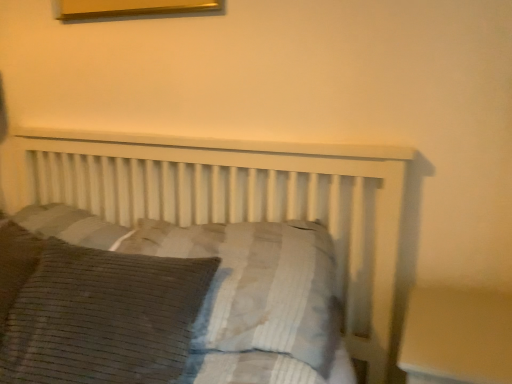
This screenshot has height=384, width=512. Describe the element at coordinates (257, 286) in the screenshot. I see `brown corduroy pillow at center, which is the 1th pillow in right-to-left order` at that location.

I want to click on brown corduroy pillow at center, which is the 1th pillow in right-to-left order, so [257, 286].

The width and height of the screenshot is (512, 384). What do you see at coordinates (103, 317) in the screenshot? I see `brown corduroy pillow at lower left, marked as the 2th pillow in a right-to-left arrangement` at bounding box center [103, 317].

The height and width of the screenshot is (384, 512). I want to click on brown corduroy pillow at lower left, marked as the 2th pillow in a right-to-left arrangement, so click(x=103, y=317).

I want to click on brown corduroy pillow at center, the second pillow positioned from the left, so click(257, 286).

Visually, is brown corduroy pillow at lower left, the 1th pillow in the left-to-right sequence, positioned to the left or to the right of brown corduroy pillow at center, the second pillow positioned from the left?

brown corduroy pillow at lower left, the 1th pillow in the left-to-right sequence, is positioned on brown corduroy pillow at center, the second pillow positioned from the left,'s left side.

Considering the positions of objects brown corduroy pillow at lower left, the 1th pillow in the left-to-right sequence, and brown corduroy pillow at center, which is the 1th pillow in right-to-left order, in the image provided, who is behind, brown corduroy pillow at lower left, the 1th pillow in the left-to-right sequence, or brown corduroy pillow at center, which is the 1th pillow in right-to-left order,?

Positioned behind is brown corduroy pillow at center, which is the 1th pillow in right-to-left order.

Which point is more forward, (159, 330) or (301, 329)?

Positioned in front is point (159, 330).

From the image's perspective, between brown corduroy pillow at lower left, the 1th pillow in the left-to-right sequence, and brown corduroy pillow at center, the second pillow positioned from the left, which one is located above?

brown corduroy pillow at center, the second pillow positioned from the left.

From a real-world perspective, who is located lower, brown corduroy pillow at lower left, the 1th pillow in the left-to-right sequence, or brown corduroy pillow at center, which is the 1th pillow in right-to-left order?

brown corduroy pillow at lower left, the 1th pillow in the left-to-right sequence, is physically lower.

Is brown corduroy pillow at lower left, marked as the 2th pillow in a right-to-left arrangement, thinner than brown corduroy pillow at center, the second pillow positioned from the left?

Yes, brown corduroy pillow at lower left, marked as the 2th pillow in a right-to-left arrangement, is thinner than brown corduroy pillow at center, the second pillow positioned from the left.

From the picture: Between brown corduroy pillow at lower left, the 1th pillow in the left-to-right sequence, and brown corduroy pillow at center, which is the 1th pillow in right-to-left order, which one has more height?

brown corduroy pillow at lower left, the 1th pillow in the left-to-right sequence, is taller.

Is brown corduroy pillow at lower left, the 1th pillow in the left-to-right sequence, bigger than brown corduroy pillow at center, which is the 1th pillow in right-to-left order?

No, brown corduroy pillow at lower left, the 1th pillow in the left-to-right sequence, is not bigger than brown corduroy pillow at center, which is the 1th pillow in right-to-left order.

Which is correct: brown corduroy pillow at lower left, marked as the 2th pillow in a right-to-left arrangement, is inside brown corduroy pillow at center, which is the 1th pillow in right-to-left order, or outside of it?

brown corduroy pillow at lower left, marked as the 2th pillow in a right-to-left arrangement, lies outside brown corduroy pillow at center, which is the 1th pillow in right-to-left order.

Consider the image. Is there a large distance between brown corduroy pillow at lower left, the 1th pillow in the left-to-right sequence, and brown corduroy pillow at center, the second pillow positioned from the left?

brown corduroy pillow at lower left, the 1th pillow in the left-to-right sequence, is near brown corduroy pillow at center, the second pillow positioned from the left, not far away.

Is brown corduroy pillow at lower left, the 1th pillow in the left-to-right sequence, aimed at brown corduroy pillow at center, the second pillow positioned from the left?

No, brown corduroy pillow at lower left, the 1th pillow in the left-to-right sequence, does not turn towards brown corduroy pillow at center, the second pillow positioned from the left.

How distant is brown corduroy pillow at lower left, the 1th pillow in the left-to-right sequence, from brown corduroy pillow at center, which is the 1th pillow in right-to-left order?

19.14 centimeters.

The width and height of the screenshot is (512, 384). Identify the location of pillow that appears in front of the brown corduroy pillow at center, the second pillow positioned from the left. 103,317.

In the scene shown: Between brown corduroy pillow at center, the second pillow positioned from the left, and brown corduroy pillow at lower left, marked as the 2th pillow in a right-to-left arrangement, which one appears on the left side from the viewer's perspective?

brown corduroy pillow at lower left, marked as the 2th pillow in a right-to-left arrangement, is more to the left.

Considering the positions of objects brown corduroy pillow at center, the second pillow positioned from the left, and brown corduroy pillow at lower left, marked as the 2th pillow in a right-to-left arrangement, in the image provided, who is in front, brown corduroy pillow at center, the second pillow positioned from the left, or brown corduroy pillow at lower left, marked as the 2th pillow in a right-to-left arrangement,?

brown corduroy pillow at lower left, marked as the 2th pillow in a right-to-left arrangement, is in front.

Is point (226, 303) closer to viewer compared to point (35, 366)?

No, it is not.

From the image's perspective, which object appears higher, brown corduroy pillow at center, the second pillow positioned from the left, or brown corduroy pillow at lower left, marked as the 2th pillow in a right-to-left arrangement?

brown corduroy pillow at center, the second pillow positioned from the left, from the image's perspective.

From a real-world perspective, which is physically above, brown corduroy pillow at center, which is the 1th pillow in right-to-left order, or brown corduroy pillow at lower left, marked as the 2th pillow in a right-to-left arrangement?

brown corduroy pillow at center, which is the 1th pillow in right-to-left order.

Considering the sizes of objects brown corduroy pillow at center, which is the 1th pillow in right-to-left order, and brown corduroy pillow at lower left, the 1th pillow in the left-to-right sequence, in the image provided, who is wider, brown corduroy pillow at center, which is the 1th pillow in right-to-left order, or brown corduroy pillow at lower left, the 1th pillow in the left-to-right sequence,?

brown corduroy pillow at center, which is the 1th pillow in right-to-left order, is wider.

Does brown corduroy pillow at center, the second pillow positioned from the left, have a lesser height compared to brown corduroy pillow at lower left, marked as the 2th pillow in a right-to-left arrangement?

Indeed, brown corduroy pillow at center, the second pillow positioned from the left, has a lesser height compared to brown corduroy pillow at lower left, marked as the 2th pillow in a right-to-left arrangement.

Considering the relative sizes of brown corduroy pillow at center, which is the 1th pillow in right-to-left order, and brown corduroy pillow at lower left, marked as the 2th pillow in a right-to-left arrangement, in the image provided, is brown corduroy pillow at center, which is the 1th pillow in right-to-left order, smaller than brown corduroy pillow at lower left, marked as the 2th pillow in a right-to-left arrangement,?

No, brown corduroy pillow at center, which is the 1th pillow in right-to-left order, is not smaller than brown corduroy pillow at lower left, marked as the 2th pillow in a right-to-left arrangement.

Is brown corduroy pillow at lower left, the 1th pillow in the left-to-right sequence, located within brown corduroy pillow at center, which is the 1th pillow in right-to-left order?

No, brown corduroy pillow at lower left, the 1th pillow in the left-to-right sequence, is not a part of brown corduroy pillow at center, which is the 1th pillow in right-to-left order.

Consider the image. Would you consider brown corduroy pillow at center, which is the 1th pillow in right-to-left order, to be distant from brown corduroy pillow at lower left, the 1th pillow in the left-to-right sequence?

No, brown corduroy pillow at center, which is the 1th pillow in right-to-left order, is not far away from brown corduroy pillow at lower left, the 1th pillow in the left-to-right sequence.

Is brown corduroy pillow at center, which is the 1th pillow in right-to-left order, facing towards brown corduroy pillow at lower left, the 1th pillow in the left-to-right sequence?

Yes, brown corduroy pillow at center, which is the 1th pillow in right-to-left order, faces towards brown corduroy pillow at lower left, the 1th pillow in the left-to-right sequence.

Can you tell me how much brown corduroy pillow at center, the second pillow positioned from the left, and brown corduroy pillow at lower left, the 1th pillow in the left-to-right sequence, differ in facing direction?

The angle between the facing direction of brown corduroy pillow at center, the second pillow positioned from the left, and the facing direction of brown corduroy pillow at lower left, the 1th pillow in the left-to-right sequence, is 7.82 degrees.

Where is `pillow located above the brown corduroy pillow at lower left, marked as the 2th pillow in a right-to-left arrangement (from the image's perspective)`? The image size is (512, 384). pillow located above the brown corduroy pillow at lower left, marked as the 2th pillow in a right-to-left arrangement (from the image's perspective) is located at coordinates (257, 286).

Where is `pillow that is under the brown corduroy pillow at center, the second pillow positioned from the left (from a real-world perspective)`? The image size is (512, 384). pillow that is under the brown corduroy pillow at center, the second pillow positioned from the left (from a real-world perspective) is located at coordinates (103, 317).

In order to click on pillow above the brown corduroy pillow at lower left, the 1th pillow in the left-to-right sequence (from a real-world perspective) in this screenshot , I will do `click(257, 286)`.